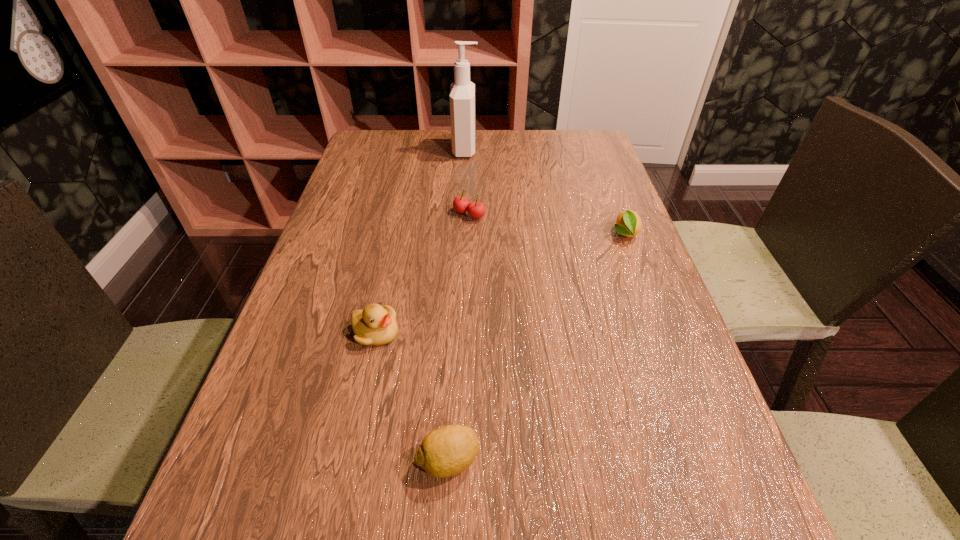
At what (x,y) coordinates should I click in order to perform the action: click on free space that is in between the nearest object and the second nearest object. Please return your answer as a coordinate pair (x, y). Looking at the image, I should click on (412, 396).

Identify the location of free area in between the farthest object and the right lemon. tap(545, 192).

Locate an element on the screen. The width and height of the screenshot is (960, 540). object that stands as the second closest to the farther lemon is located at coordinates (462, 92).

In order to click on object that is the fourth closest one to the duckling in this screenshot , I will do `click(462, 92)`.

Identify the location of free spot that satisfies the following two spatial constraints: 1. on the front label of the tallest object; 2. on the left side of the cherry. (463, 214).